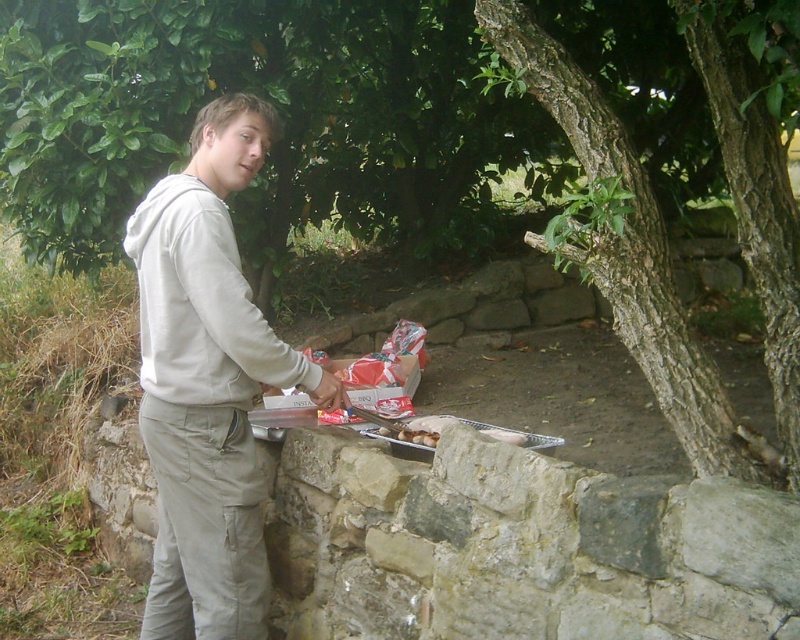
Question: Which of the following is the farthest from the observer?

Choices:
 (A) (721, 413)
 (B) (196, 492)
 (C) (176, 291)

Answer: (B)

Question: Which is farther from the white fleece sweatshirt at center?

Choices:
 (A) brown rough bark tree at center
 (B) light gray hoodie at center

Answer: (A)

Question: Observing the image, what is the correct spatial positioning of light gray hoodie at center in reference to brown rough bark tree at center?

Choices:
 (A) above
 (B) below

Answer: (B)

Question: Which point is closer to the camera?

Choices:
 (A) white fleece sweatshirt at center
 (B) light gray hoodie at center
 (C) brown rough bark tree at center

Answer: (C)

Question: From the image, what is the correct spatial relationship of light gray hoodie at center in relation to white fleece sweatshirt at center?

Choices:
 (A) below
 (B) above

Answer: (A)

Question: Is light gray hoodie at center thinner than brown rough bark tree at center?

Choices:
 (A) no
 (B) yes

Answer: (B)